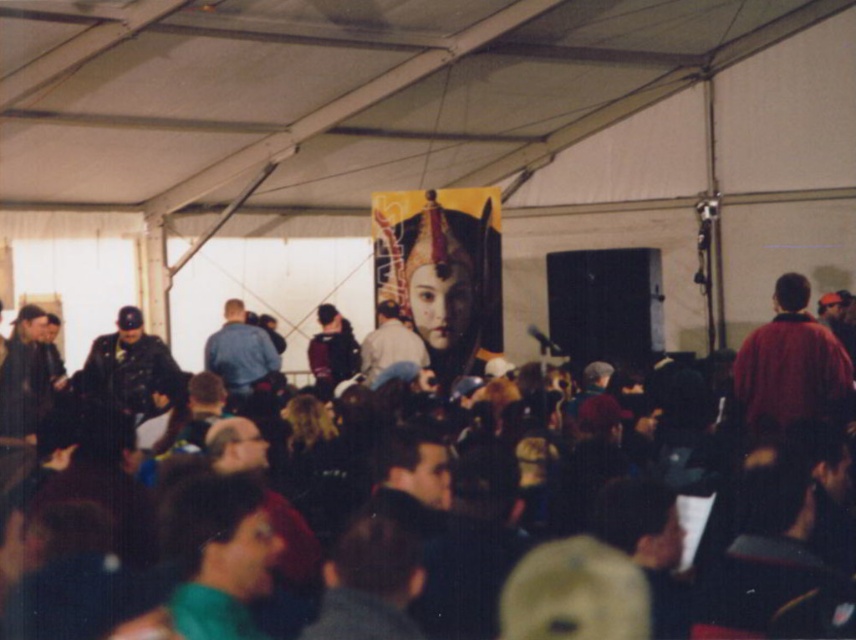
You are organizing a photo shoot and need to place a mannequin wearing a red matte jacket at right and a blue denim jacket at center. Given their sizes, which jacket should be placed closer to the camera to ensure both are visible in the frame?

The red matte jacket at right is smaller than the blue denim jacket at center. To ensure both are visible, the smaller red matte jacket at right should be placed closer to the camera so that its size in the frame matches the larger blue denim jacket at center.